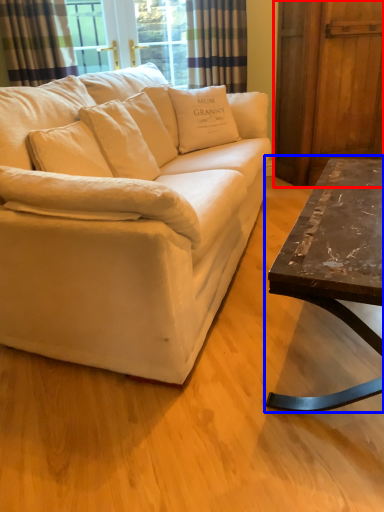
Question: Which of the following is the farthest to the observer, barn door (highlighted by a red box) or coffee table (highlighted by a blue box)?

Choices:
 (A) barn door
 (B) coffee table

Answer: (A)